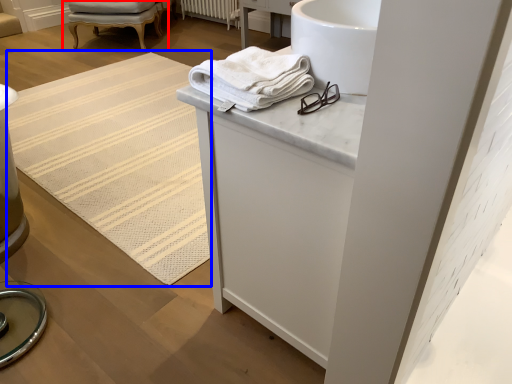
Question: Among these objects, which one is farthest to the camera, chair (highlighted by a red box) or mat (highlighted by a blue box)?

Choices:
 (A) chair
 (B) mat

Answer: (A)